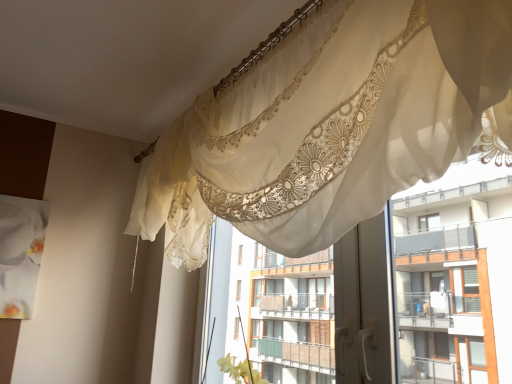
This screenshot has height=384, width=512. In order to click on sheer lace curtain at upper center in this screenshot , I will do `click(329, 125)`.

This screenshot has width=512, height=384. What do you see at coordinates (329, 125) in the screenshot?
I see `sheer lace curtain at upper center` at bounding box center [329, 125].

Image resolution: width=512 pixels, height=384 pixels. What do you see at coordinates (455, 275) in the screenshot?
I see `sheer lace curtains at upper center` at bounding box center [455, 275].

Where is `sheer lace curtains at upper center`? The width and height of the screenshot is (512, 384). sheer lace curtains at upper center is located at coordinates (455, 275).

Locate an element on the screen. This screenshot has width=512, height=384. sheer lace curtain at upper center is located at coordinates (329, 125).

Visually, is sheer lace curtain at upper center positioned to the left or to the right of sheer lace curtains at upper center?

In the image, sheer lace curtain at upper center appears on the left side of sheer lace curtains at upper center.

Which is in front, sheer lace curtain at upper center or sheer lace curtains at upper center?

sheer lace curtain at upper center is more forward.

Between point (315, 57) and point (247, 281), which one is positioned behind?

Positioned behind is point (247, 281).

From the image's perspective, is sheer lace curtain at upper center located above or below sheer lace curtains at upper center?

Based on their image positions, sheer lace curtain at upper center is located above sheer lace curtains at upper center.

From a real-world perspective, which is physically above, sheer lace curtain at upper center or sheer lace curtains at upper center?

sheer lace curtain at upper center.

Between sheer lace curtain at upper center and sheer lace curtains at upper center, which one has smaller width?

sheer lace curtains at upper center.

Considering the sizes of objects sheer lace curtain at upper center and sheer lace curtains at upper center in the image provided, who is shorter, sheer lace curtain at upper center or sheer lace curtains at upper center?

Standing shorter between the two is sheer lace curtain at upper center.

Looking at this image, looking at the image, does sheer lace curtain at upper center seem bigger or smaller compared to sheer lace curtains at upper center?

Clearly, sheer lace curtain at upper center is larger in size than sheer lace curtains at upper center.

Would you say sheer lace curtain at upper center contains sheer lace curtains at upper center?

No, sheer lace curtains at upper center is not a part of sheer lace curtain at upper center.

Is there a large distance between sheer lace curtain at upper center and sheer lace curtains at upper center?

Indeed, sheer lace curtain at upper center is not near sheer lace curtains at upper center.

Does sheer lace curtain at upper center turn towards sheer lace curtains at upper center?

No, sheer lace curtain at upper center is not turned towards sheer lace curtains at upper center.

Can you tell me how much sheer lace curtain at upper center and sheer lace curtains at upper center differ in facing direction?

The angle between the facing direction of sheer lace curtain at upper center and the facing direction of sheer lace curtains at upper center is 0.0747 degrees.

Identify the location of curtain lying in front of the sheer lace curtains at upper center. click(329, 125).

Considering the positions of objects sheer lace curtains at upper center and sheer lace curtain at upper center in the image provided, who is more to the right, sheer lace curtains at upper center or sheer lace curtain at upper center?

Positioned to the right is sheer lace curtains at upper center.

Is sheer lace curtains at upper center in front of or behind sheer lace curtain at upper center in the image?

sheer lace curtains at upper center is behind sheer lace curtain at upper center.

Considering the positions of point (484, 317) and point (419, 130), is point (484, 317) closer or farther from the camera than point (419, 130)?

Point (484, 317).

From the image's perspective, is sheer lace curtains at upper center over sheer lace curtain at upper center?

Incorrect, from the image's perspective, sheer lace curtains at upper center is lower than sheer lace curtain at upper center.

From a real-world perspective, which is physically below, sheer lace curtains at upper center or sheer lace curtain at upper center?

From a 3D spatial view, sheer lace curtains at upper center is below.

Considering the sizes of sheer lace curtains at upper center and sheer lace curtain at upper center in the image, is sheer lace curtains at upper center wider or thinner than sheer lace curtain at upper center?

sheer lace curtains at upper center is thinner than sheer lace curtain at upper center.

Which of these two, sheer lace curtains at upper center or sheer lace curtain at upper center, stands taller?

Standing taller between the two is sheer lace curtains at upper center.

Who is smaller, sheer lace curtains at upper center or sheer lace curtain at upper center?

With smaller size is sheer lace curtains at upper center.

Choose the correct answer: Is sheer lace curtains at upper center inside sheer lace curtain at upper center or outside it?

sheer lace curtains at upper center lies outside sheer lace curtain at upper center.

Is sheer lace curtains at upper center directly adjacent to sheer lace curtain at upper center?

No, sheer lace curtains at upper center is not beside sheer lace curtain at upper center.

Is sheer lace curtains at upper center facing away from sheer lace curtain at upper center?

No, sheer lace curtain at upper center is not at the back of sheer lace curtains at upper center.

How different are the orientations of sheer lace curtains at upper center and sheer lace curtain at upper center in degrees?

0.0747 degrees.

Measure the distance from sheer lace curtains at upper center to sheer lace curtain at upper center.

A distance of 1.08 meters exists between sheer lace curtains at upper center and sheer lace curtain at upper center.

Image resolution: width=512 pixels, height=384 pixels. I want to click on residence located below the sheer lace curtain at upper center (from the image's perspective), so click(x=455, y=275).

This screenshot has height=384, width=512. What are the coordinates of `curtain above the sheer lace curtains at upper center (from a real-world perspective)` in the screenshot? It's located at (329, 125).

You are a GUI agent. You are given a task and a screenshot of the screen. Output one action in this format:
    pyautogui.click(x=<x>, y=<y>)
    Task: Click on the residence below the sheer lace curtain at upper center (from a real-world perspective)
    
    Given the screenshot: What is the action you would take?
    pyautogui.click(x=455, y=275)